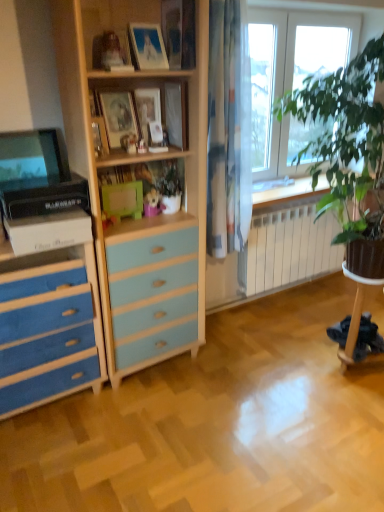
Question: In the image, is matte wooden picture frame at center, which ranks as the 3th picture frame in front-to-back order, on the left side or the right side of wooden picture frames at upper center?

Choices:
 (A) right
 (B) left

Answer: (A)

Question: In terms of height, does matte wooden picture frame at center, which ranks as the 3th picture frame in front-to-back order, look taller or shorter compared to wooden picture frames at upper center?

Choices:
 (A) tall
 (B) short

Answer: (B)

Question: Estimate the real-world distances between objects in this image. Which object is farther from the matte black monitor at left?

Choices:
 (A) blue painted wood chest of drawers at left
 (B) matte glass picture frame at upper center, which ranks as the third picture frame in back-to-front order
 (C) matte wooden picture frame at upper center, which ranks as the 2th picture frame in front-to-back order
 (D) matte wooden picture frame at center, which ranks as the 3th picture frame in front-to-back order
 (E) wooden picture frames at upper center

Answer: (C)

Question: Estimate the real-world distances between objects in this image. Which object is farther from the white metallic radiator at lower right?

Choices:
 (A) matte black monitor at left
 (B) matte wooden picture frame at upper center, which ranks as the 2th picture frame in front-to-back order
 (C) blue painted wood chest of drawers at left
 (D) matte wooden picture frame at center, which is counted as the 1th picture frame, starting from the back
 (E) wooden picture frames at upper center

Answer: (A)